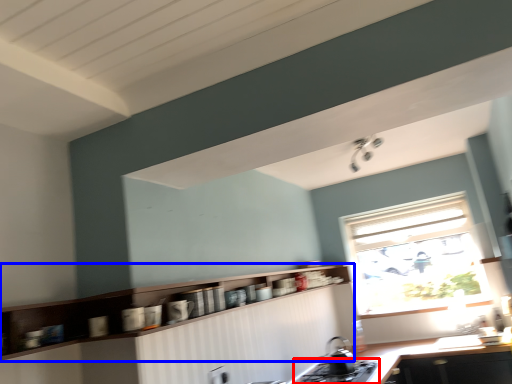
Question: Among these objects, which one is farthest to the camera, gas stove (highlighted by a red box) or cabinetry (highlighted by a blue box)?

Choices:
 (A) gas stove
 (B) cabinetry

Answer: (A)